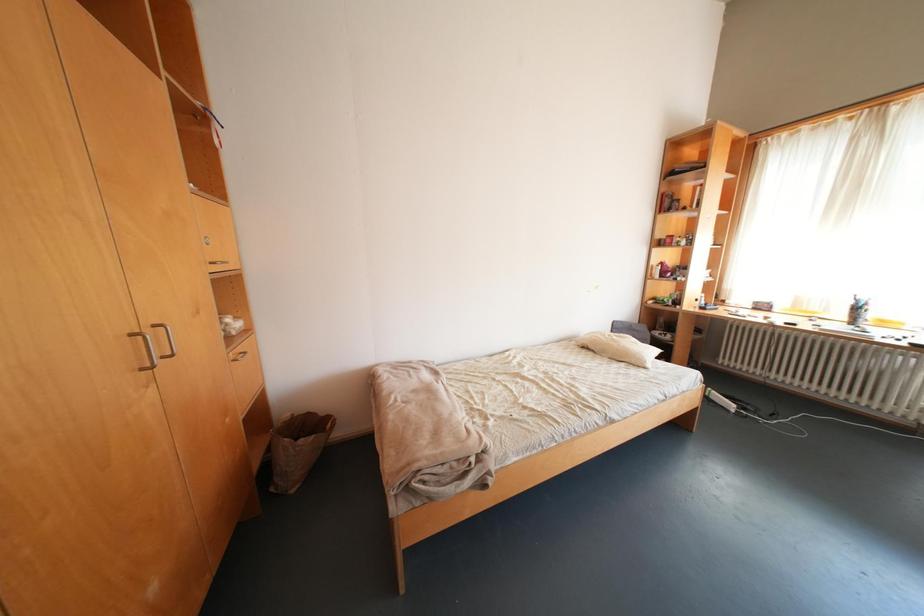
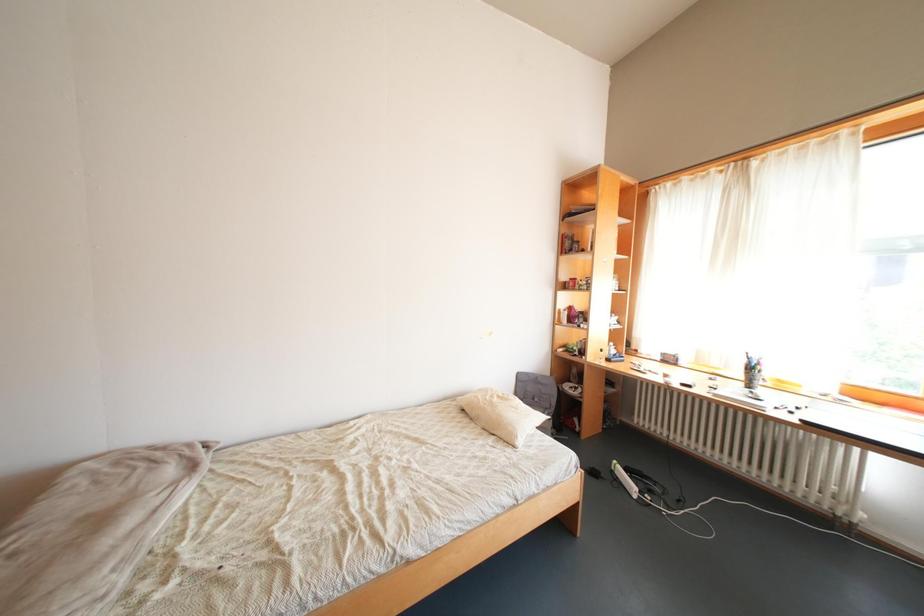
Question: The first image is from the beginning of the video and the second image is from the end. How did the camera likely rotate when shooting the video?

Choices:
 (A) Left
 (B) Right
 (C) Up
 (D) Down

Answer: (C)